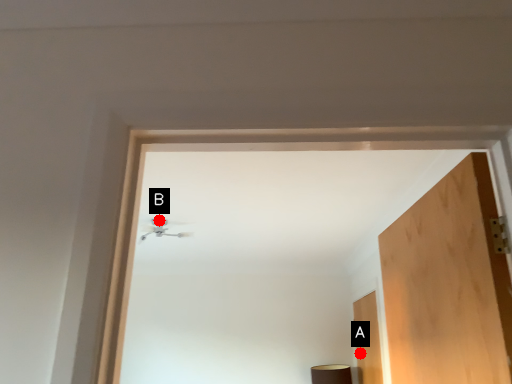
Question: Two points are circled on the image, labeled by A and B beside each circle. Which point appears farthest from the camera in this image?

Choices:
 (A) A is further
 (B) B is further

Answer: (A)